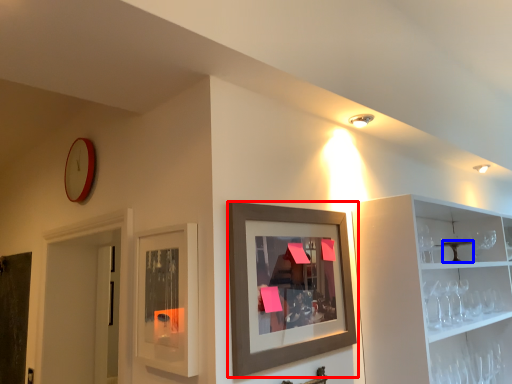
Question: Which point is closer to the camera, picture frame (highlighted by a red box) or table (highlighted by a blue box)?

Choices:
 (A) picture frame
 (B) table

Answer: (A)